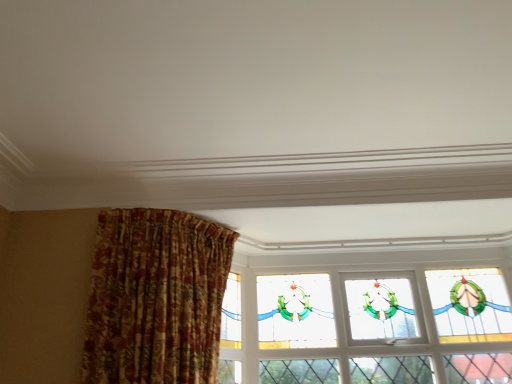
Question: Relative to floral fabric curtain at left, is stained glass window at upper center in front or behind?

Choices:
 (A) behind
 (B) front

Answer: (A)

Question: Looking at their shapes, would you say stained glass window at upper center is wider or thinner than floral fabric curtain at left?

Choices:
 (A) wide
 (B) thin

Answer: (B)

Question: Considering the positions of stained glass window at upper center and floral fabric curtain at left in the image, is stained glass window at upper center taller or shorter than floral fabric curtain at left?

Choices:
 (A) tall
 (B) short

Answer: (A)

Question: Is floral fabric curtain at left taller or shorter than stained glass window at upper center?

Choices:
 (A) tall
 (B) short

Answer: (B)

Question: Is floral fabric curtain at left inside the boundaries of stained glass window at upper center, or outside?

Choices:
 (A) outside
 (B) inside

Answer: (A)

Question: Considering the positions of floral fabric curtain at left and stained glass window at upper center in the image, is floral fabric curtain at left wider or thinner than stained glass window at upper center?

Choices:
 (A) wide
 (B) thin

Answer: (A)

Question: Is floral fabric curtain at left bigger or smaller than stained glass window at upper center?

Choices:
 (A) small
 (B) big

Answer: (B)